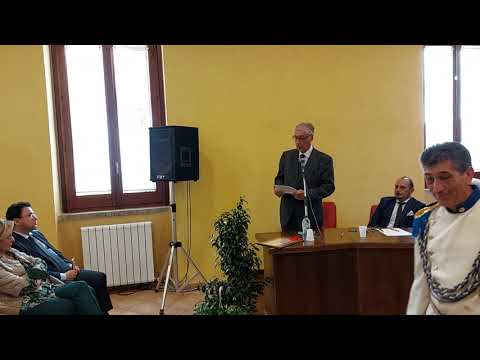
Find the location of a particular element. The width and height of the screenshot is (480, 360). cup is located at coordinates (309, 234), (364, 232).